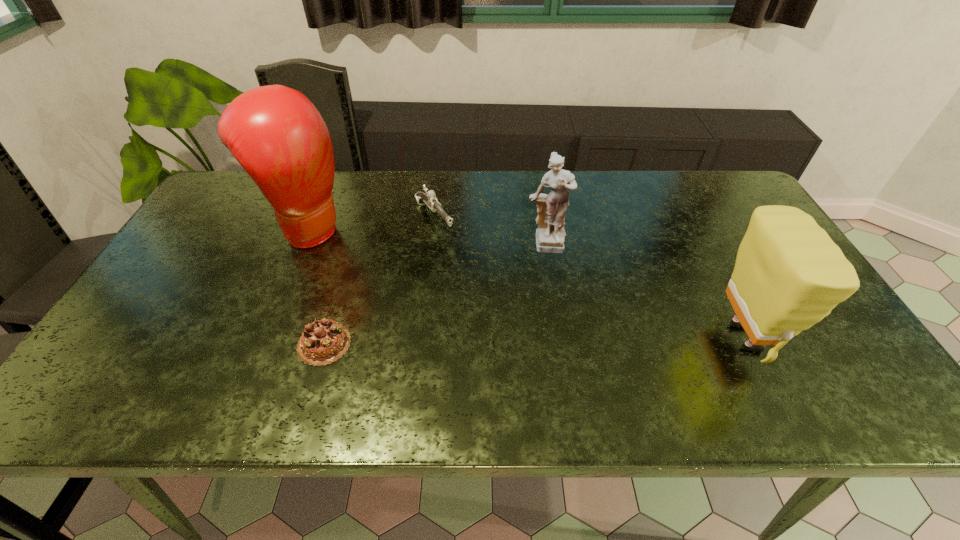
Locate an element on the screen. The width and height of the screenshot is (960, 540). chocolate cake is located at coordinates (324, 341).

At what (x,y) coordinates should I click in order to perform the action: click on sponge. Please return your answer as a coordinate pair (x, y). Looking at the image, I should click on (789, 274).

You are a GUI agent. You are given a task and a screenshot of the screen. Output one action in this format:
    pyautogui.click(x=<x>, y=<y>)
    Task: Click on the second object from right to left
    This screenshot has height=540, width=960.
    Given the screenshot: What is the action you would take?
    (550, 234)

Identify the location of the third object from right to left. (429, 198).

Where is `the second shortest object`? This screenshot has height=540, width=960. the second shortest object is located at coordinates (429, 198).

Locate an element on the screen. boxing glove is located at coordinates (277, 135).

Locate an element on the screen. free space located 0.370m on the right of the shortest object is located at coordinates (513, 344).

This screenshot has width=960, height=540. In order to click on vacant area located on the face of the rightmost object in this screenshot , I will do `click(823, 337)`.

Image resolution: width=960 pixels, height=540 pixels. Identify the location of blank area located 0.130m on the front-facing side of the fourth object from left to right. (553, 298).

Locate an element on the screen. The width and height of the screenshot is (960, 540). vacant area located 0.170m on the front-facing side of the fourth object from left to right is located at coordinates (556, 310).